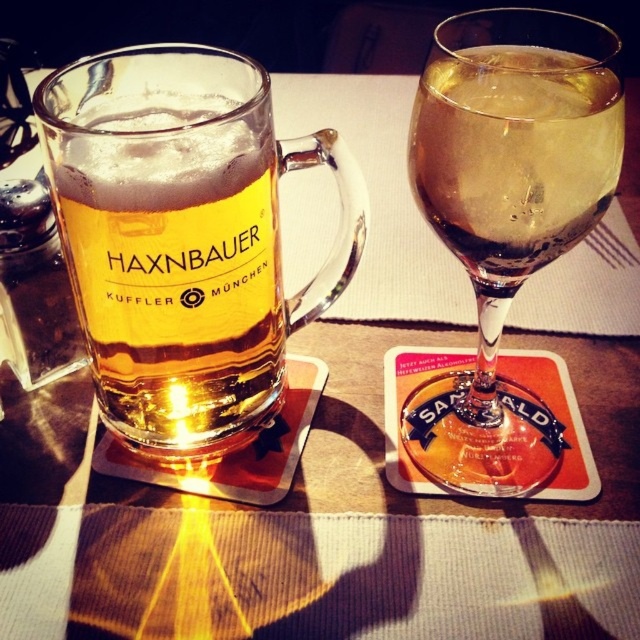
Question: Does golden glass beer mug at left appear on the right side of translucent glass at upper right?

Choices:
 (A) no
 (B) yes

Answer: (A)

Question: Is clear glass wine at right to the right of translucent glass at upper right from the viewer's perspective?

Choices:
 (A) yes
 (B) no

Answer: (A)

Question: Which of the following is the closest to the observer?

Choices:
 (A) golden glass beer mug at left
 (B) translucent glass at upper right

Answer: (B)

Question: Among these objects, which one is farthest from the camera?

Choices:
 (A) translucent glass at upper right
 (B) clear glass wine at right
 (C) golden glass beer mug at left

Answer: (C)

Question: Can you confirm if clear glass wine at right is bigger than golden glass beer mug at left?

Choices:
 (A) yes
 (B) no

Answer: (A)

Question: Estimate the real-world distances between objects in this image. Which object is farther from the translucent glass at upper right?

Choices:
 (A) clear glass wine at right
 (B) golden glass beer mug at left

Answer: (B)